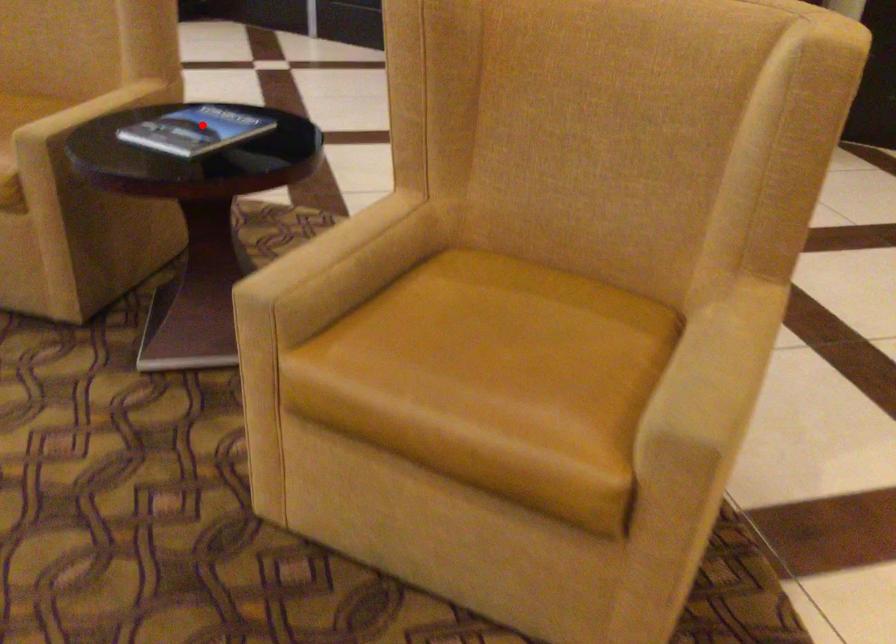
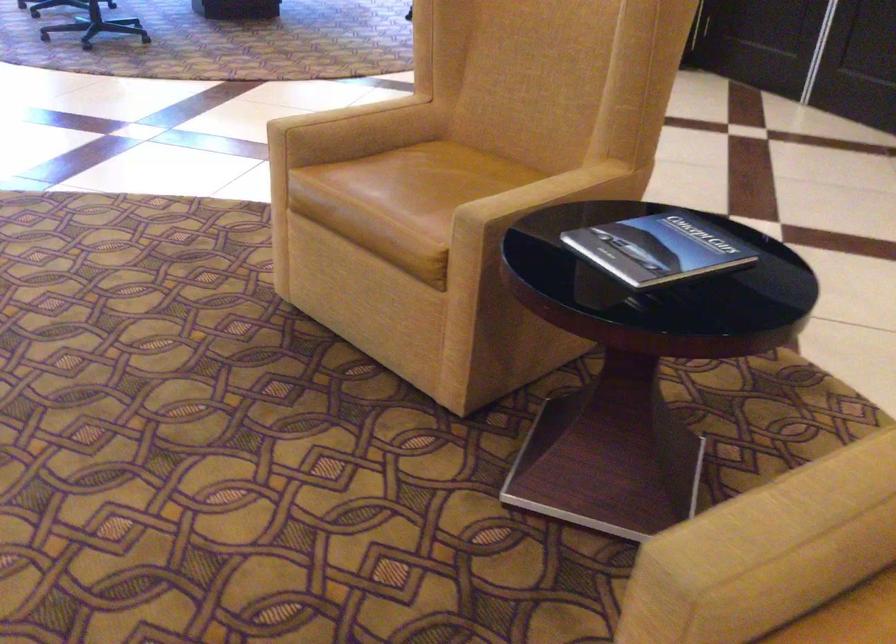
Find the pixel in the second image that matches the highlighted location in the first image.

(657, 249)